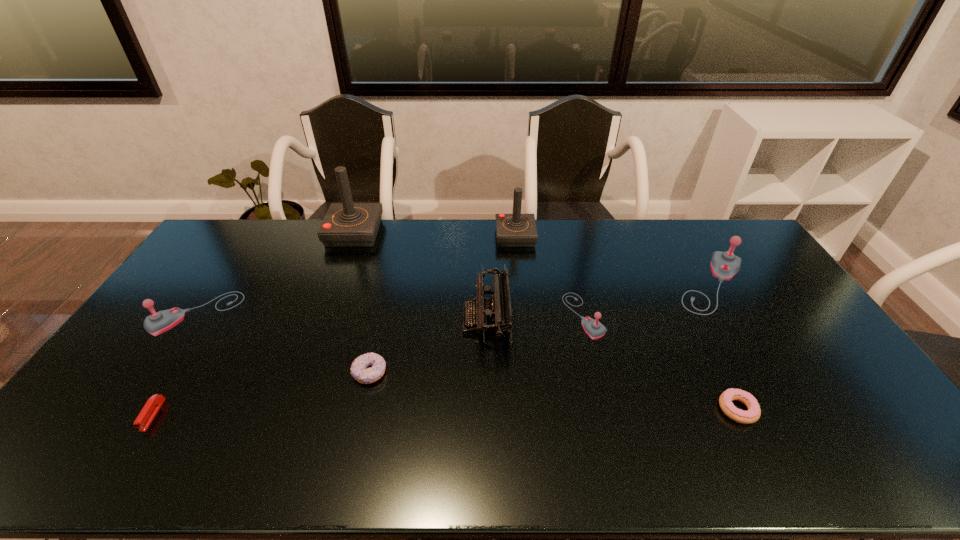
Identify the location of vacant space at the near edge of the desktop. (181, 457).

In order to click on vacant space at the left edge in this screenshot , I will do `click(138, 394)`.

Identify the location of vacant space at the right edge of the desktop. The height and width of the screenshot is (540, 960). (826, 370).

In the image, there is a desktop. Where is `vacant space at the near left corner`? This screenshot has width=960, height=540. vacant space at the near left corner is located at coordinates (84, 461).

Find the location of a particular element. Image resolution: width=960 pixels, height=540 pixels. empty space that is in between the farther doughnut and the second shortest joystick is located at coordinates (282, 343).

Identify the location of free space between the typewriter and the tallest joystick. This screenshot has height=540, width=960. [420, 276].

Where is `vacant area between the red stapler and the nearer doughnut`? The width and height of the screenshot is (960, 540). vacant area between the red stapler and the nearer doughnut is located at coordinates (445, 412).

The height and width of the screenshot is (540, 960). In order to click on vacant area that lies between the typewriter and the second joystick from left to right in this screenshot , I will do `click(420, 276)`.

Where is `free point between the second joystick from right to left and the tallest object`? This screenshot has height=540, width=960. free point between the second joystick from right to left and the tallest object is located at coordinates (468, 274).

You are a GUI agent. You are given a task and a screenshot of the screen. Output one action in this format:
    pyautogui.click(x=<x>, y=<y>)
    Task: Click on the vacant region between the typewriter and the brown doughnut
    The image size is (960, 540).
    Given the screenshot: What is the action you would take?
    pyautogui.click(x=428, y=346)